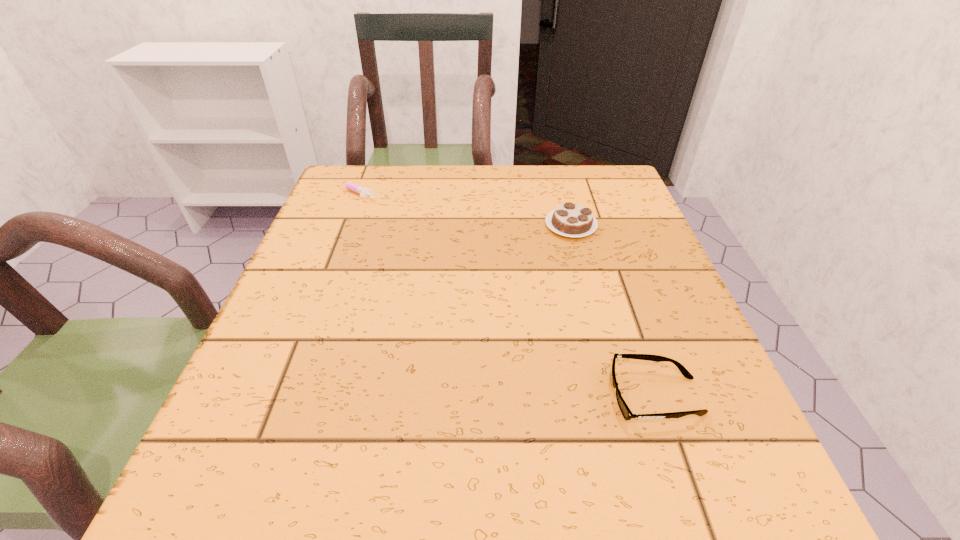
The width and height of the screenshot is (960, 540). I want to click on syringe that is at the far edge, so click(363, 192).

I want to click on object that is positioned at the left edge, so click(x=363, y=192).

At what (x,y) coordinates should I click in order to perform the action: click on chocolate cake that is at the right edge. Please return your answer as a coordinate pair (x, y). Looking at the image, I should click on (571, 220).

Where is `sunglasses present at the right edge`? sunglasses present at the right edge is located at coordinates (626, 412).

Find the location of a particular element. The width and height of the screenshot is (960, 540). object that is at the far left corner is located at coordinates (363, 192).

Identify the location of object that is at the far right corner. Image resolution: width=960 pixels, height=540 pixels. (571, 220).

Locate an element on the screen. blank space at the far edge of the desktop is located at coordinates (407, 189).

In the image, there is a desktop. Where is `free space at the near edge`? The height and width of the screenshot is (540, 960). free space at the near edge is located at coordinates (396, 508).

In the image, there is a desktop. In order to click on vacant area at the left edge in this screenshot , I will do `click(350, 233)`.

In the image, there is a desktop. What are the coordinates of `vacant region at the right edge` in the screenshot? It's located at (661, 392).